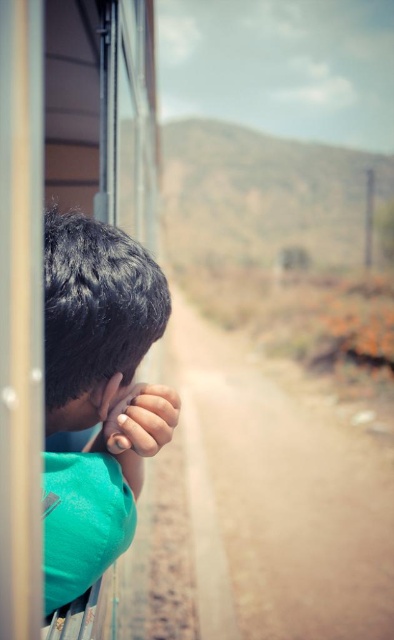
Does dark brown hair at left have a lesser height compared to nail polish painted fingernails at lower left?

Incorrect, dark brown hair at left's height does not fall short of nail polish painted fingernails at lower left's.

Is point (61, 307) closer to camera compared to point (148, 410)?

Yes, it is in front of point (148, 410).

Identify the location of dark brown hair at left. The width and height of the screenshot is (394, 640). (94, 316).